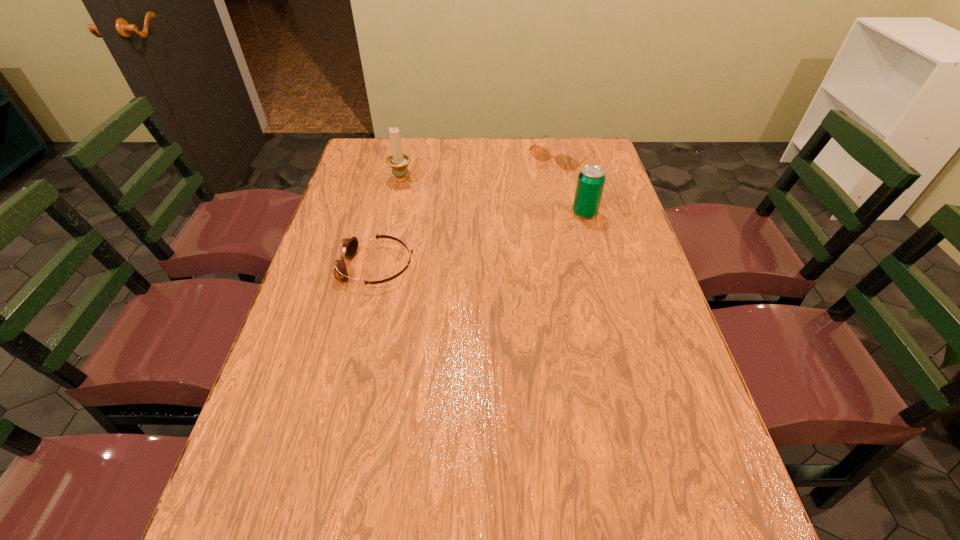
The height and width of the screenshot is (540, 960). In order to click on free space between the third farthest object and the candle_holder in this screenshot , I will do tap(492, 197).

Where is `free space between the third shortest object and the candle_holder`? This screenshot has height=540, width=960. free space between the third shortest object and the candle_holder is located at coordinates (492, 197).

Locate an element on the screen. empty space between the nearest object and the tallest object is located at coordinates (389, 223).

The height and width of the screenshot is (540, 960). I want to click on empty space that is in between the goggles and the second tallest object, so click(x=481, y=240).

Where is `free space between the beer can and the goggles`? The image size is (960, 540). free space between the beer can and the goggles is located at coordinates (481, 240).

The height and width of the screenshot is (540, 960). What are the coordinates of `free space between the tallest object and the goggles` in the screenshot? It's located at (389, 223).

Where is `empty space that is in between the sunglasses and the candle_holder`? Image resolution: width=960 pixels, height=540 pixels. empty space that is in between the sunglasses and the candle_holder is located at coordinates (481, 168).

Locate which object is the closest to the goggles. Please provide its 2D coordinates. Your answer should be formatted as a tuple, i.e. [(x, y)], where the tuple contains the x and y coordinates of a point satisfying the conditions above.

[(398, 161)]

This screenshot has height=540, width=960. Identify the location of object that can be found as the second closest to the tallest object. (566, 162).

Where is `vacant area that satisfies the following two spatial constraints: 1. on the front side of the third farthest object; 2. on the left side of the sunglasses`? This screenshot has height=540, width=960. vacant area that satisfies the following two spatial constraints: 1. on the front side of the third farthest object; 2. on the left side of the sunglasses is located at coordinates (575, 213).